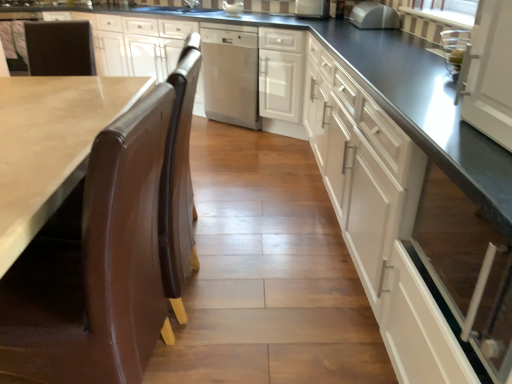
Locate an element on the screen. vacant space situated above satin white refrigerator at upper center, the 2th appliance when ordered from right to left (from a real-world perspective) is located at coordinates (314, 0).